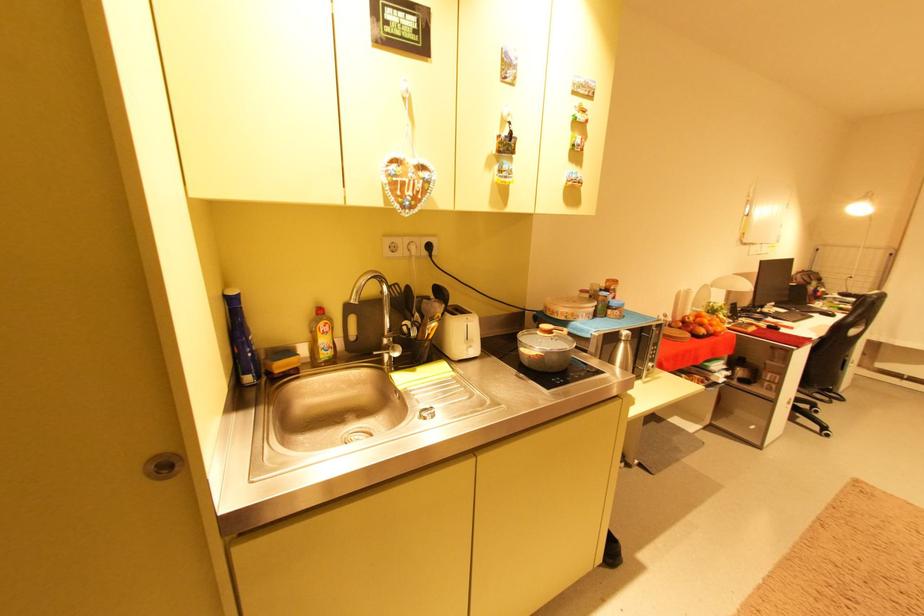
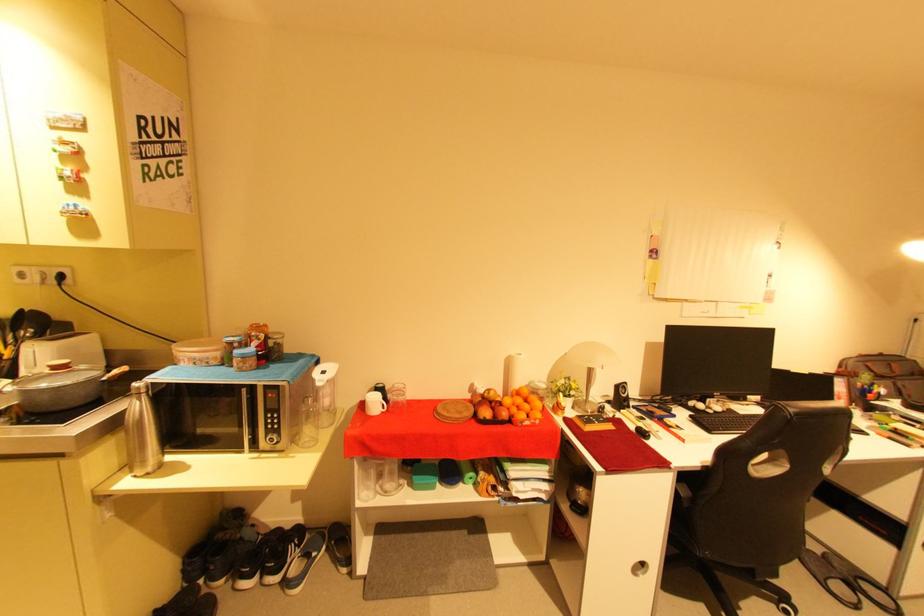
The point at (714, 331) is marked in the first image. Where is the corresponding point in the second image?

(503, 416)